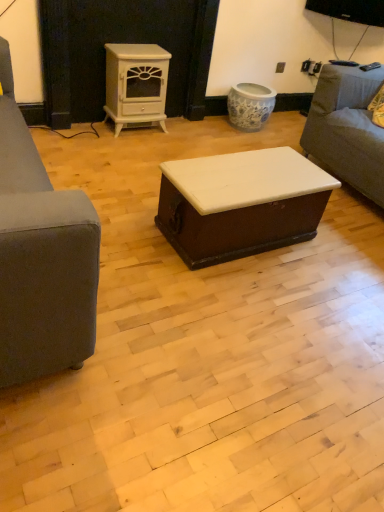
Locate an element on the screen. This screenshot has height=512, width=384. free spot to the right of white glossy trunk at center is located at coordinates (332, 258).